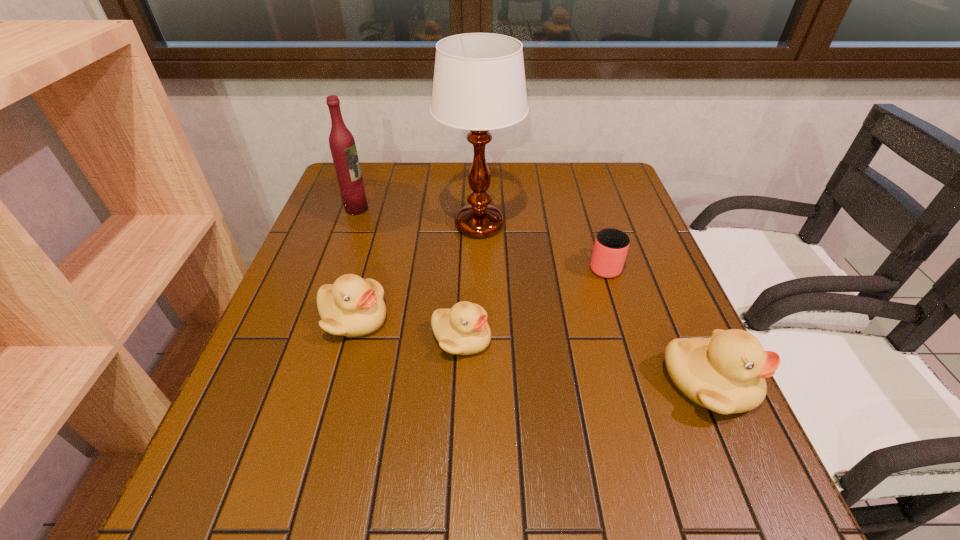
I want to click on empty location between the table lamp and the fourth tallest object, so click(417, 272).

Image resolution: width=960 pixels, height=540 pixels. Identify the location of vacant space that's between the liquor and the tallest object. tap(419, 217).

Identify the location of empty space that is in between the rightmost duckling and the cup. The height and width of the screenshot is (540, 960). (656, 325).

You are a GUI agent. You are given a task and a screenshot of the screen. Output one action in this format:
    pyautogui.click(x=<x>, y=<y>)
    Task: Click on the free space that is in between the second tallest duckling and the second duckling from left to right
    This screenshot has width=960, height=540.
    Given the screenshot: What is the action you would take?
    pyautogui.click(x=408, y=328)

The image size is (960, 540). Find the location of `unoccupied position between the rightmost duckling and the fifth shortest object`. unoccupied position between the rightmost duckling and the fifth shortest object is located at coordinates (532, 296).

This screenshot has width=960, height=540. I want to click on vacant area that lies between the second object from right to left and the rightmost duckling, so click(656, 325).

Identify which object is the second nearest to the cup. Please provide its 2D coordinates. Your answer should be formatted as a tuple, i.e. [(x, y)], where the tuple contains the x and y coordinates of a point satisfying the conditions above.

[(725, 373)]

Point out which object is positioned as the nearest to the rightmost duckling. Please provide its 2D coordinates. Your answer should be formatted as a tuple, i.e. [(x, y)], where the tuple contains the x and y coordinates of a point satisfying the conditions above.

[(611, 245)]

Locate which duckling ranks in proximity to the rightmost duckling. Please provide its 2D coordinates. Your answer should be formatted as a tuple, i.e. [(x, y)], where the tuple contains the x and y coordinates of a point satisfying the conditions above.

[(463, 330)]

Locate which duckling ranks in proximity to the table lamp. Please provide its 2D coordinates. Your answer should be formatted as a tuple, i.e. [(x, y)], where the tuple contains the x and y coordinates of a point satisfying the conditions above.

[(352, 306)]